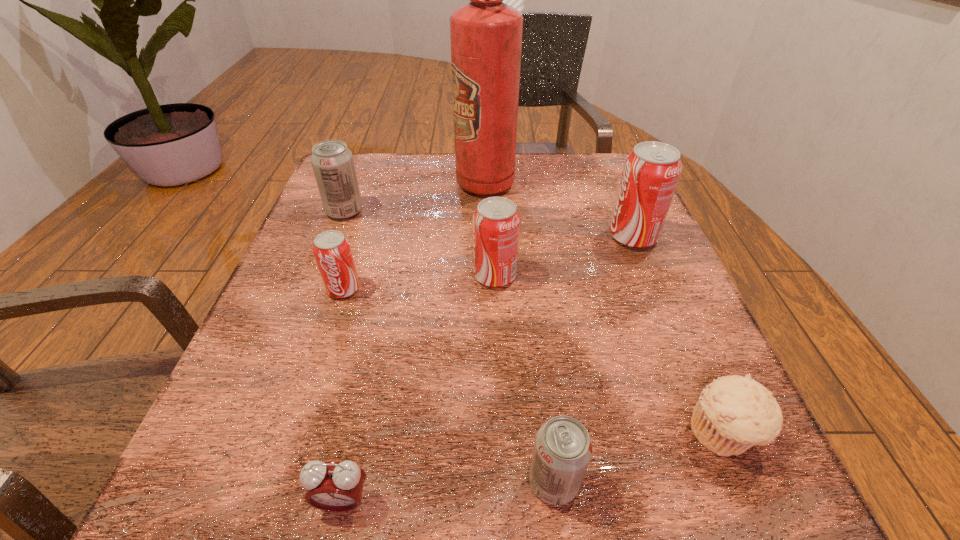
This screenshot has height=540, width=960. I want to click on vacant region between the second red soda can from right to left and the leftmost red soda can, so click(x=420, y=282).

This screenshot has width=960, height=540. Find the location of `free area in between the beige muffin and the smallest red soda can`. free area in between the beige muffin and the smallest red soda can is located at coordinates (533, 361).

I want to click on unoccupied area between the beige muffin and the biggest red soda can, so click(678, 335).

What are the coordinates of `vacant area that lies between the second smallest red soda can and the nearest soda can` in the screenshot? It's located at click(524, 379).

Locate an element on the screen. vacant space that is in between the beige muffin and the red fire extinguisher is located at coordinates (604, 308).

Identify the location of empty location between the red fire extinguisher and the sixth nearest object. The width and height of the screenshot is (960, 540). tap(559, 210).

Image resolution: width=960 pixels, height=540 pixels. Identify the location of vacant area that lies between the second red soda can from left to right and the muffin. (609, 354).

Image resolution: width=960 pixels, height=540 pixels. In order to click on free space between the second red soda can from right to left and the smallest red soda can in this screenshot , I will do `click(420, 282)`.

This screenshot has height=540, width=960. Identify the location of object identified as the fifth closest to the fire extinguisher. (734, 413).

Locate an element on the screen. This screenshot has width=960, height=540. object that ranks as the seventh closest to the seventh nearest object is located at coordinates (734, 413).